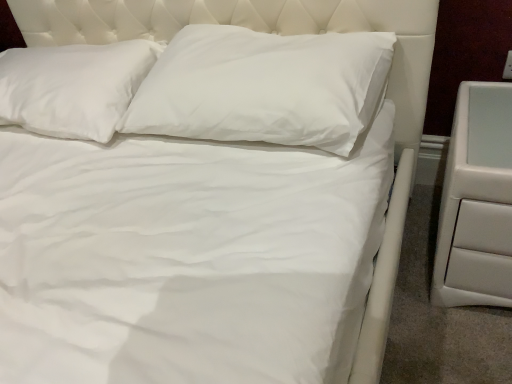
Question: Is white smooth pillow at center, positioned as the second pillow in left-to-right order, taller or shorter than white leather nightstand at right?

Choices:
 (A) short
 (B) tall

Answer: (A)

Question: Is point (175, 82) closer or farther from the camera than point (450, 205)?

Choices:
 (A) closer
 (B) farther

Answer: (B)

Question: Based on their relative distances, which object is nearer to the white smooth pillow at center, positioned as the second pillow in left-to-right order?

Choices:
 (A) white soft pillow at upper center, the 2th pillow in the right-to-left sequence
 (B) white leather nightstand at right

Answer: (A)

Question: Which object is positioned farthest from the white leather nightstand at right?

Choices:
 (A) white soft pillow at upper center, the 1th pillow when ordered from left to right
 (B) white smooth pillow at center, which is the 1th pillow from right to left

Answer: (A)